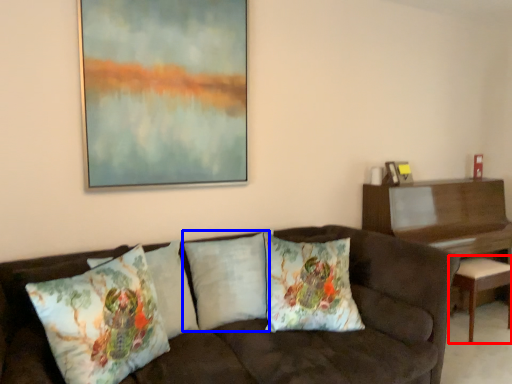
Question: Which point is closer to the camera, stool (highlighted by a red box) or pillow (highlighted by a blue box)?

Choices:
 (A) stool
 (B) pillow

Answer: (B)